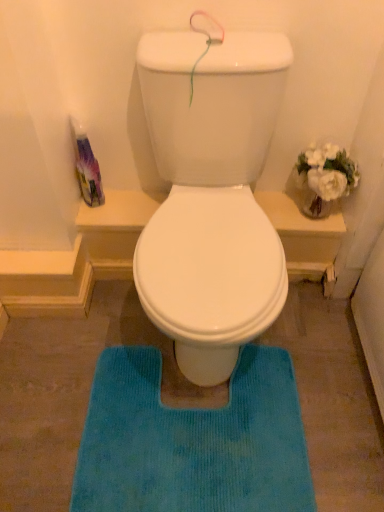
Question: From the image's perspective, is translucent plastic bottle at left located above or below blue textured bath mat at center?

Choices:
 (A) below
 (B) above

Answer: (B)

Question: Is translucent plastic bottle at left situated inside blue textured bath mat at center or outside?

Choices:
 (A) outside
 (B) inside

Answer: (A)

Question: In terms of height, does translucent plastic bottle at left look taller or shorter compared to blue textured bath mat at center?

Choices:
 (A) short
 (B) tall

Answer: (B)

Question: From their relative heights in the image, would you say blue textured bath mat at center is taller or shorter than translucent plastic bottle at left?

Choices:
 (A) tall
 (B) short

Answer: (B)

Question: Do you think blue textured bath mat at center is within translucent plastic bottle at left, or outside of it?

Choices:
 (A) outside
 (B) inside

Answer: (A)

Question: From a real-world perspective, is blue textured bath mat at center physically located above or below translucent plastic bottle at left?

Choices:
 (A) above
 (B) below

Answer: (B)

Question: Considering their positions, is blue textured bath mat at center located in front of or behind translucent plastic bottle at left?

Choices:
 (A) front
 (B) behind

Answer: (A)